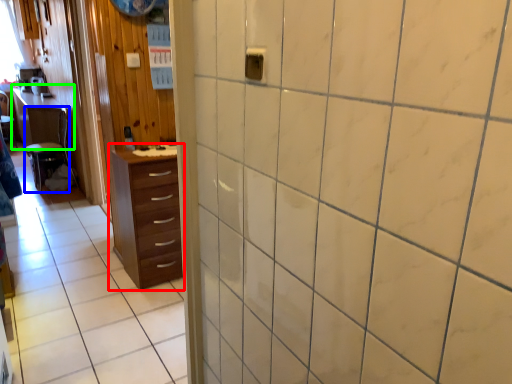
Question: Which object is positioned closest to chest of drawers (highlighted by a red box)? Select from furniture (highlighted by a blue box) and table (highlighted by a green box).

Choices:
 (A) furniture
 (B) table

Answer: (A)